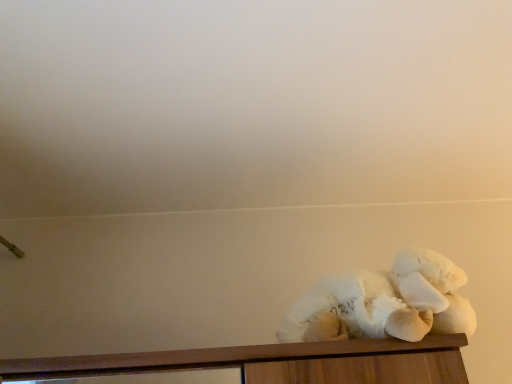
Question: Considering the relative positions of white fluffy teddy bear at right and wooden cabinet at lower right in the image provided, is white fluffy teddy bear at right to the left or to the right of wooden cabinet at lower right?

Choices:
 (A) left
 (B) right

Answer: (B)

Question: From the image's perspective, relative to wooden cabinet at lower right, is white fluffy teddy bear at right above or below?

Choices:
 (A) above
 (B) below

Answer: (A)

Question: Is white fluffy teddy bear at right in front of or behind wooden cabinet at lower right in the image?

Choices:
 (A) behind
 (B) front

Answer: (A)

Question: From a real-world perspective, relative to white fluffy teddy bear at right, is wooden cabinet at lower right vertically above or below?

Choices:
 (A) below
 (B) above

Answer: (A)

Question: Is point (198, 349) positioned closer to the camera than point (340, 331)?

Choices:
 (A) closer
 (B) farther

Answer: (A)

Question: Considering the positions of wooden cabinet at lower right and white fluffy teddy bear at right in the image, is wooden cabinet at lower right wider or thinner than white fluffy teddy bear at right?

Choices:
 (A) thin
 (B) wide

Answer: (B)

Question: From the image's perspective, is wooden cabinet at lower right located above or below white fluffy teddy bear at right?

Choices:
 (A) above
 (B) below

Answer: (B)